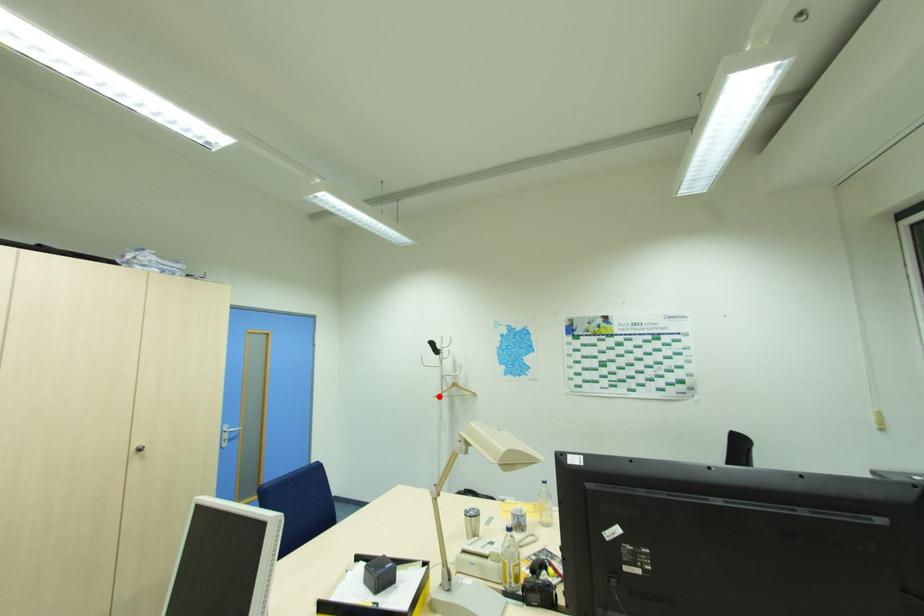
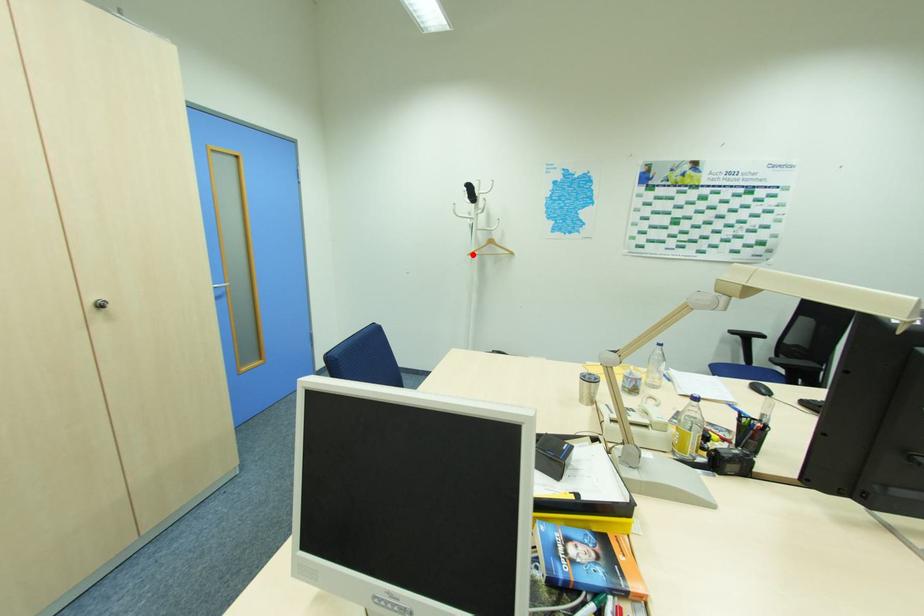
I am providing you with two images of the same scene from different viewpoints. A red point is marked on the first image and another point is marked on the second image. Is the marked point in image1 the same physical position as the marked point in image2?

Yes